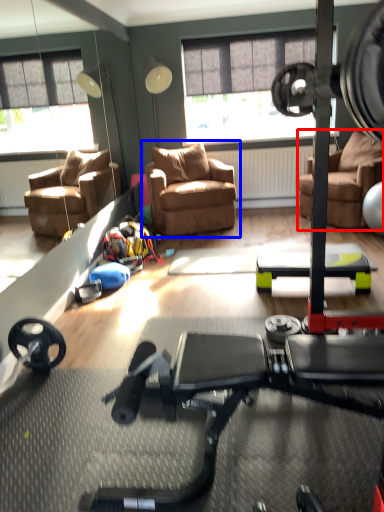
Question: Among these objects, which one is farthest to the camera, chair (highlighted by a red box) or chair (highlighted by a blue box)?

Choices:
 (A) chair
 (B) chair

Answer: (B)